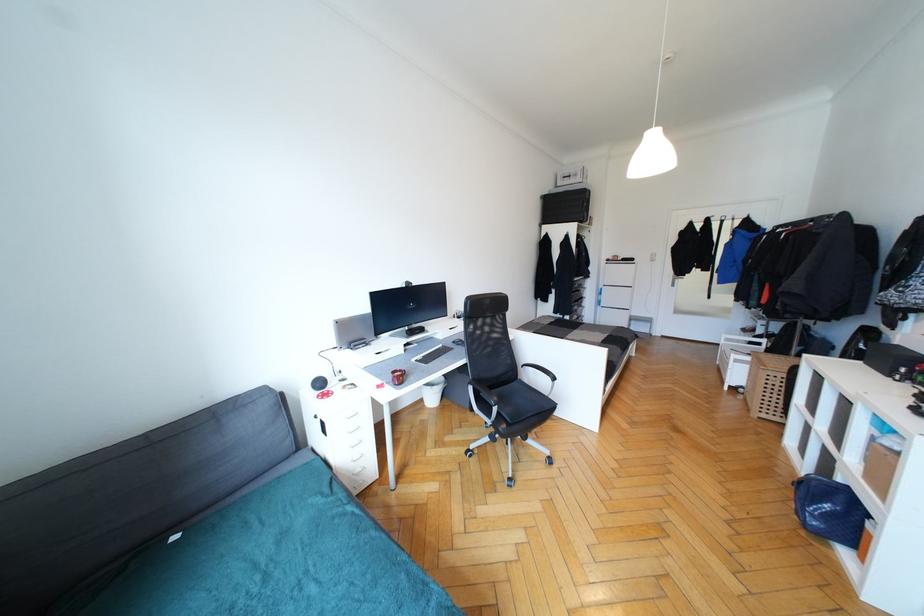
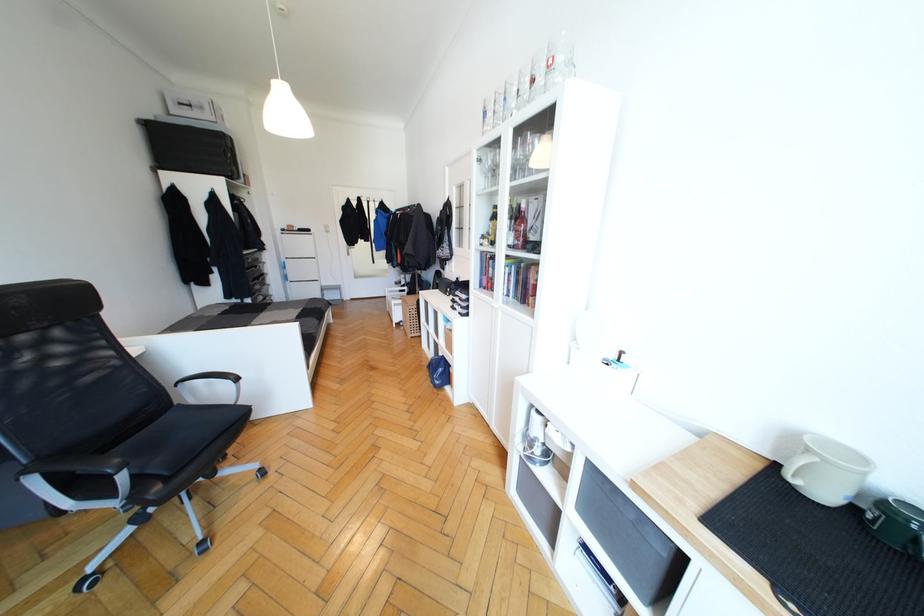
In the second image, find the point that corresponds to [845,499] in the first image.

(445, 363)